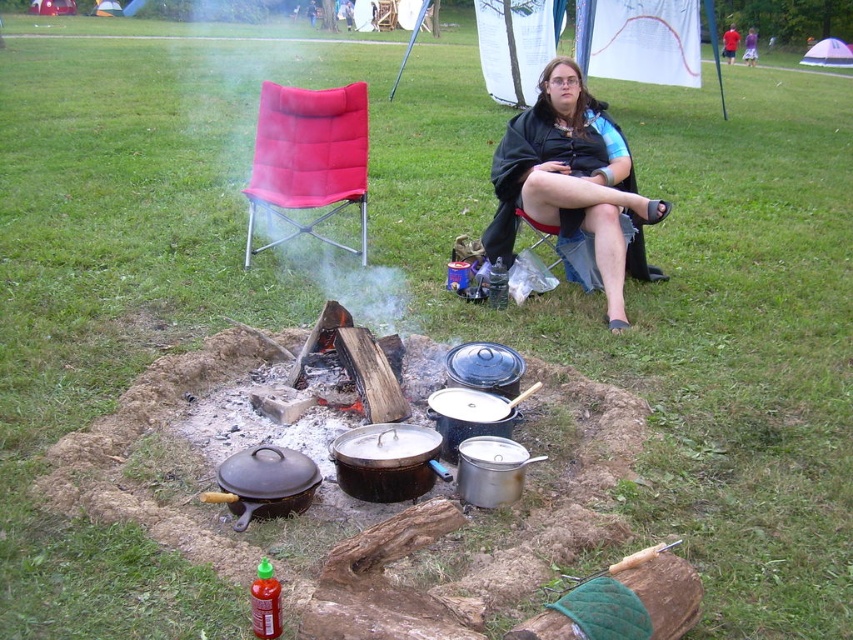
Looking at this image, is black fabric cape at center smaller than red fabric folding chair at center?

Incorrect, black fabric cape at center is not smaller in size than red fabric folding chair at center.

Locate an element on the screen. The width and height of the screenshot is (853, 640). black fabric cape at center is located at coordinates (572, 180).